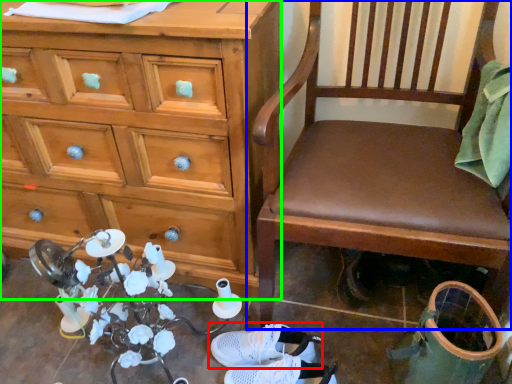
Question: Estimate the real-world distances between objects in this image. Which object is farther from footwear (highlighted by a red box), chair (highlighted by a blue box) or chest of drawers (highlighted by a green box)?

Choices:
 (A) chair
 (B) chest of drawers

Answer: (B)